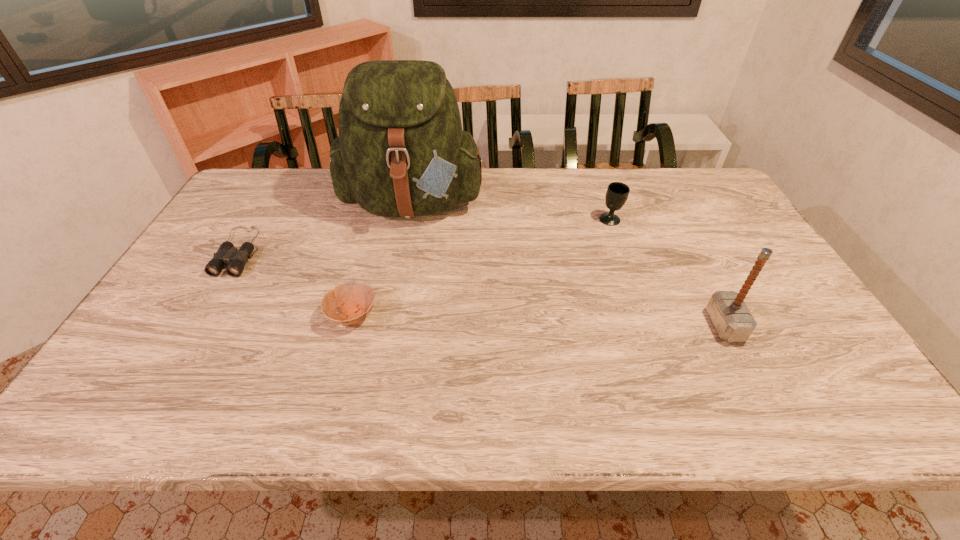
What are the coordinates of `backpack` in the screenshot? It's located at (401, 152).

The width and height of the screenshot is (960, 540). I want to click on the fourth shortest object, so click(733, 321).

Identify the location of the rightmost object. (733, 321).

Image resolution: width=960 pixels, height=540 pixels. In order to click on the third tallest object in this screenshot , I will do `click(617, 193)`.

Image resolution: width=960 pixels, height=540 pixels. I want to click on the fourth object from left to right, so click(x=617, y=193).

What are the coordinates of `bowl` in the screenshot? It's located at (357, 298).

In order to click on the leftmost object in this screenshot , I will do `click(236, 259)`.

Image resolution: width=960 pixels, height=540 pixels. I want to click on binoculars, so click(x=236, y=259).

Locate an element on the screen. This screenshot has width=960, height=540. vacant region located 0.110m on the open flap of the tallest object is located at coordinates (402, 266).

Locate an element on the screen. vacant space located on the striking surface of the hammer is located at coordinates (601, 325).